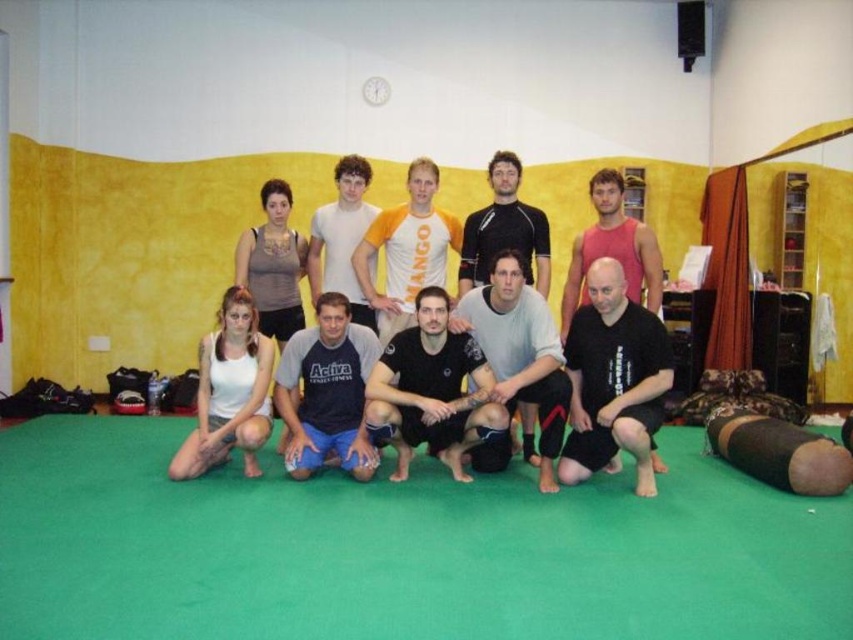
Question: Can you confirm if black matte t-shirt at center is thinner than yellow/orange jersey at center?

Choices:
 (A) no
 (B) yes

Answer: (A)

Question: Which of these objects is positioned closest to the black matte shirt at center?

Choices:
 (A) matte red tank top at center
 (B) black matte t-shirt at center
 (C) white matte tank top at lower left
 (D) white cotton t-shirt at center

Answer: (A)

Question: Which object is closer to the camera taking this photo?

Choices:
 (A) matte gray t-shirt at center
 (B) dark gray t-shirt at center
 (C) black matte t-shirt at center
 (D) white matte tank top at lower left

Answer: (C)

Question: Which object is positioned closest to the white cotton t-shirt at center?

Choices:
 (A) black matte t-shirt at lower center
 (B) white matte tank top at lower left
 (C) matte red tank top at center

Answer: (B)

Question: From the image, what is the correct spatial relationship of black matte t-shirt at center in relation to white matte tank top at lower left?

Choices:
 (A) right
 (B) left

Answer: (A)

Question: Does dark gray t-shirt at center appear on the right side of white cotton t-shirt at center?

Choices:
 (A) yes
 (B) no

Answer: (B)